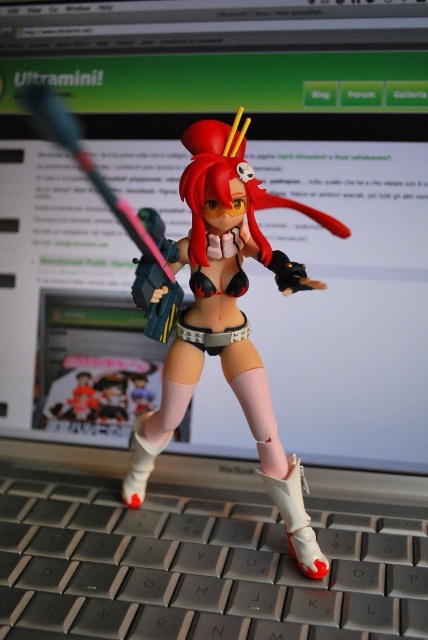
You are trying to place a new action figure on the laptop keyboard. The keyboard is represented by the point at coordinates point (199, 568). Where should you place the action figure to ensure it is centered on the keyboard?

The gray plastic keyboard at lower center is represented by point (199, 568). To center the action figure on the keyboard, place it exactly at the coordinates point (199, 568).

You are a photographer trying to capture a clear shot of the satin black figure at center. However, the gray plastic keyboard at lower center is blocking part of the figure. Can you adjust your camera angle to avoid the keyboard while still keeping the figure in the frame?

The gray plastic keyboard at lower center is below the satin black figure at center, so you can tilt the camera upward to focus on the satin black figure at center while avoiding the keyboard.

You are setting up a desk for a display. You have a gray plastic keyboard at lower center and a satin black figure at center. Which object takes up more space on the desk?

The satin black figure at center takes up more space on the desk than the gray plastic keyboard at lower center because the gray plastic keyboard at lower center has a smaller size compared to satin black figure at center.